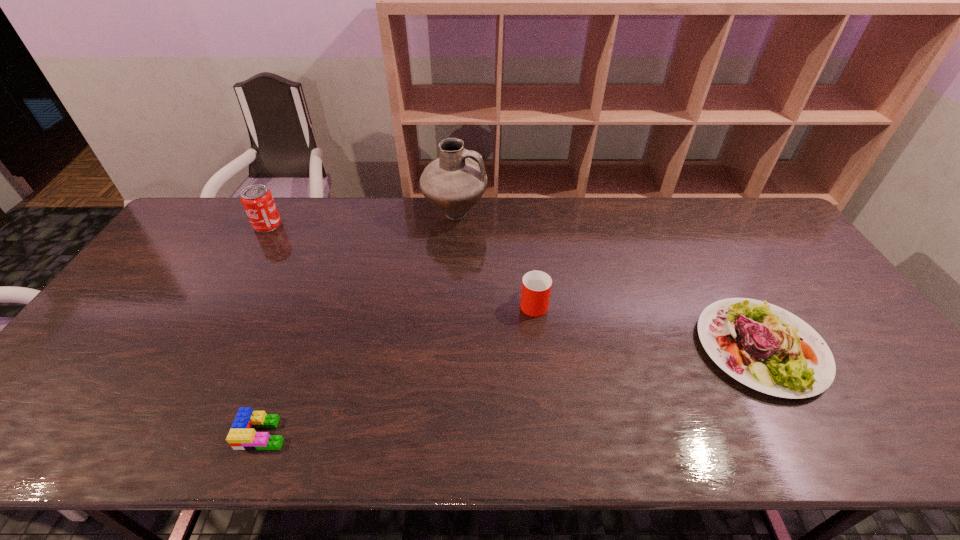
What are the coordinates of `free space located 0.090m on the handle side of the third object from right to left` in the screenshot? It's located at (513, 215).

Where is `free location located on the left of the fourth shortest object`? The image size is (960, 540). free location located on the left of the fourth shortest object is located at coordinates (209, 225).

Identify the location of vacant space located on the side of the third tallest object with the handle. (531, 276).

Image resolution: width=960 pixels, height=540 pixels. Identify the location of vacant space situated on the side of the third tallest object with the handle. (529, 261).

Where is `vacant area located on the side of the third tallest object with the handle`? This screenshot has width=960, height=540. vacant area located on the side of the third tallest object with the handle is located at coordinates (529, 263).

I want to click on free space located 0.070m on the back of the salad plate, so click(x=725, y=285).

This screenshot has width=960, height=540. I want to click on vacant region located 0.220m on the left of the shortest object, so click(x=140, y=433).

You are a GUI agent. You are given a task and a screenshot of the screen. Output one action in this format:
    pyautogui.click(x=<x>, y=<y>)
    Task: Click on the pitcher at the far edge
    Image resolution: width=960 pixels, height=540 pixels.
    Given the screenshot: What is the action you would take?
    pyautogui.click(x=454, y=183)

Image resolution: width=960 pixels, height=540 pixels. In order to click on can positioned at the far edge in this screenshot , I will do `click(257, 200)`.

This screenshot has height=540, width=960. Find the location of `object located at the near edge`. object located at the near edge is located at coordinates (242, 436).